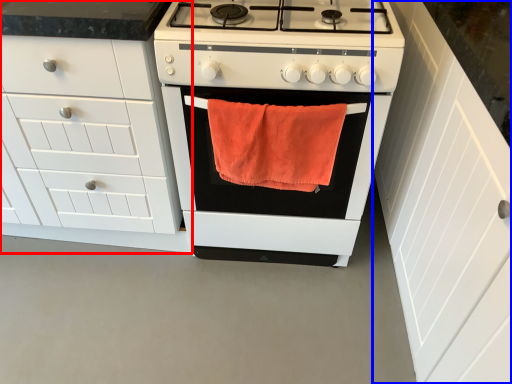
Question: Among these objects, which one is farthest to the camera, cabinetry (highlighted by a red box) or cabinetry (highlighted by a blue box)?

Choices:
 (A) cabinetry
 (B) cabinetry

Answer: (A)